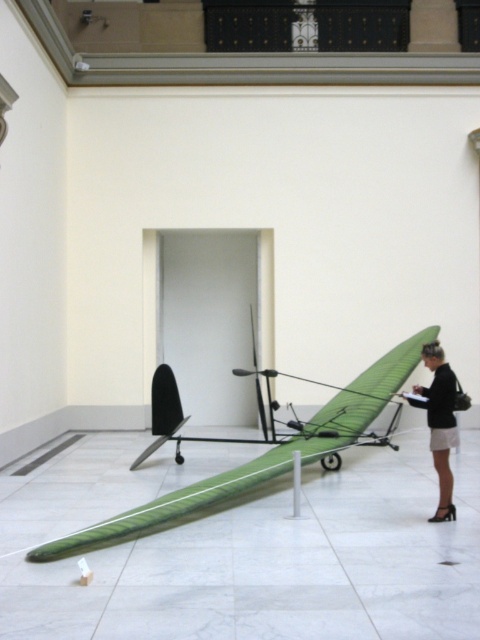
Does green fabric plane at center have a larger size compared to black leather skirt at lower right?

No.

Between green fabric plane at center and black leather skirt at lower right, which one appears on the right side from the viewer's perspective?

black leather skirt at lower right is more to the right.

Between point (312, 420) and point (443, 400), which one is positioned in front?

Point (443, 400)

The image size is (480, 640). I want to click on green fabric plane at center, so click(262, 456).